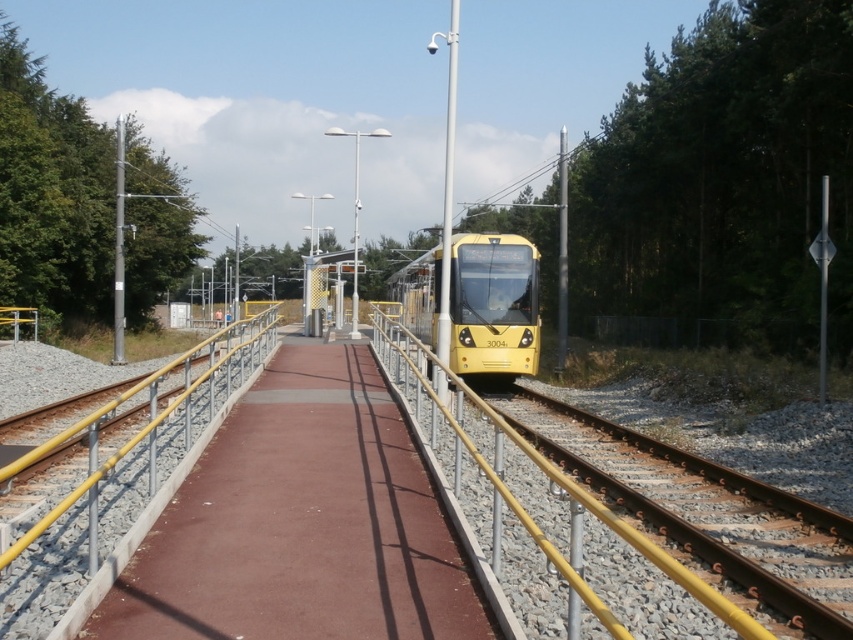
Question: Can you confirm if smooth concrete path at center is smaller than yellow metallic rail at left?

Choices:
 (A) yes
 (B) no

Answer: (A)

Question: Which of the following is the closest to the observer?

Choices:
 (A) yellow metallic track at center
 (B) yellow metallic rail at left

Answer: (A)

Question: Observing the image, what is the correct spatial positioning of smooth concrete path at center in reference to green leafy tree at left?

Choices:
 (A) above
 (B) below

Answer: (B)

Question: Which point is closer to the camera?

Choices:
 (A) yellow metallic rail at left
 (B) yellow metallic track at center
 (C) yellow matte train at center

Answer: (B)

Question: Is yellow metallic track at center thinner than yellow matte train at center?

Choices:
 (A) yes
 (B) no

Answer: (A)

Question: Considering the real-world distances, which object is closest to the yellow metallic track at center?

Choices:
 (A) yellow metallic rail at left
 (B) green leafy tree at left
 (C) yellow matte train at center
 (D) smooth concrete path at center

Answer: (D)